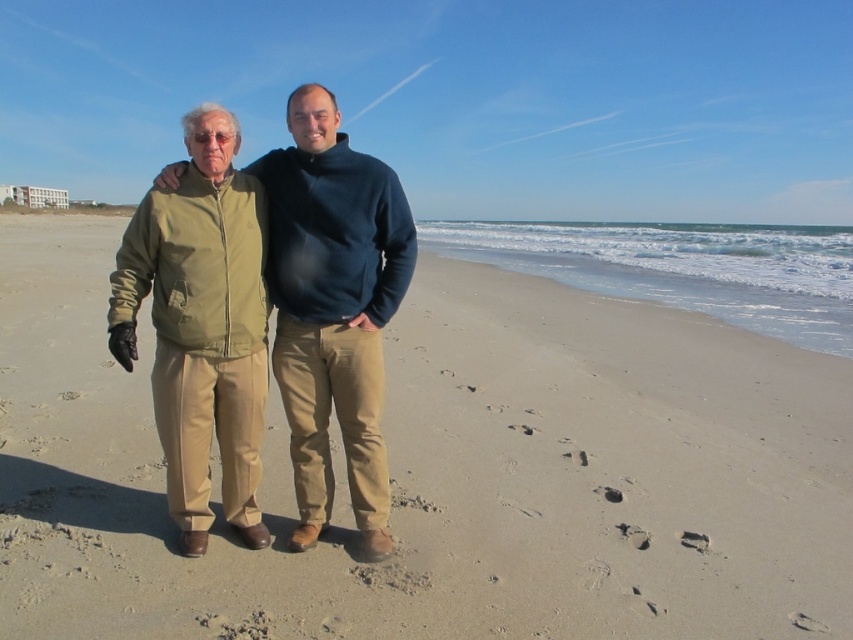
You are a photographer trying to capture a closeup of the khaki cotton pants at center. Since the light brown sand at center is in the way, can you move the sand out of the frame without disturbing the pants?

The light brown sand at center is larger in size than khaki cotton pants at center, so moving the sand might not be necessary as the pants are smaller and could be positioned behind the sand. However, since the sand is larger, it might block the pants unless adjusted carefully.

You are a photographer trying to capture a clear shot of the khaki cotton pants at center without the light brown sand at center blocking the view. How should you adjust your camera angle?

The light brown sand at center is positioned over khaki cotton pants at center, so you should lower your camera angle to look upward to avoid the sand blocking the pants.

You are a photographer trying to capture a photo where both the light brown sand at center and the khaki cotton pants at center are visible. Based on their positions, which one is more likely to be fully visible in the frame?

The light brown sand at center is wider than khaki cotton pants at center, so the light brown sand at center is more likely to be fully visible in the frame.